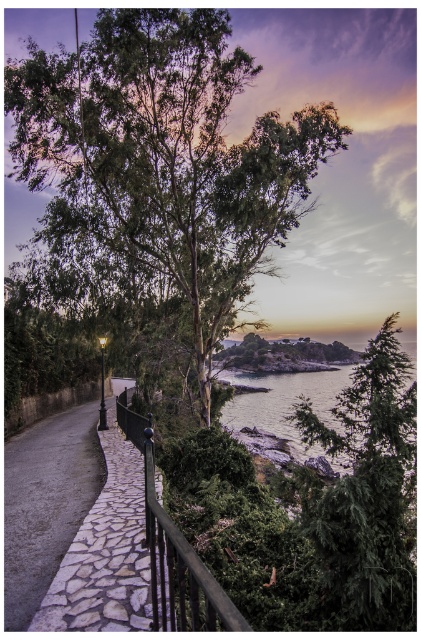
Question: Is gray stone pavement at left to the right of black metal rail at center from the viewer's perspective?

Choices:
 (A) yes
 (B) no

Answer: (B)

Question: Is green textured tree at right positioned before gray stone pavement at left?

Choices:
 (A) yes
 (B) no

Answer: (B)

Question: Does green textured tree at right have a lesser width compared to black metal rail at center?

Choices:
 (A) no
 (B) yes

Answer: (B)

Question: Which object is closer to the camera taking this photo?

Choices:
 (A) green textured tree at right
 (B) black metal rail at center
 (C) gray stone pavement at left

Answer: (B)

Question: Which of these objects is positioned closest to the green textured tree at right?

Choices:
 (A) green leafy tree at center
 (B) gray stone pavement at left

Answer: (B)

Question: Which object is farther from the camera taking this photo?

Choices:
 (A) green leafy tree at center
 (B) black metal rail at center
 (C) green textured tree at right

Answer: (A)